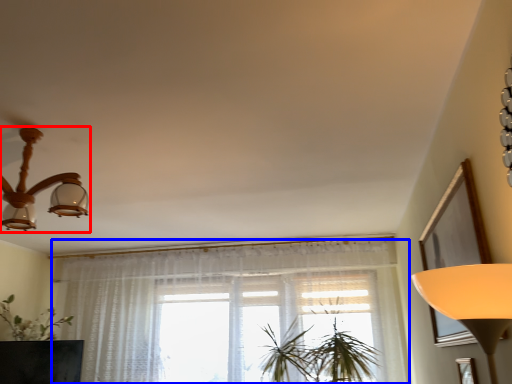
Question: Which object appears closest to the camera in this image, lamp (highlighted by a red box) or curtain (highlighted by a blue box)?

Choices:
 (A) lamp
 (B) curtain

Answer: (A)